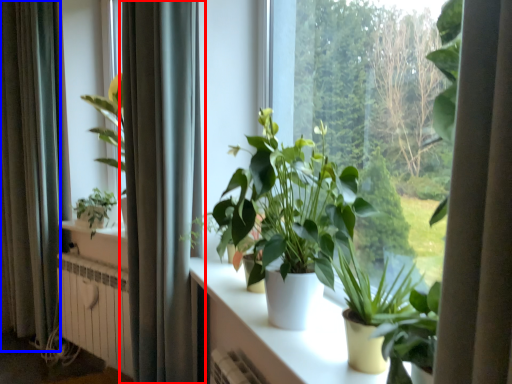
Question: Which object is further to the camera taking this photo, curtain (highlighted by a red box) or curtain (highlighted by a blue box)?

Choices:
 (A) curtain
 (B) curtain

Answer: (B)